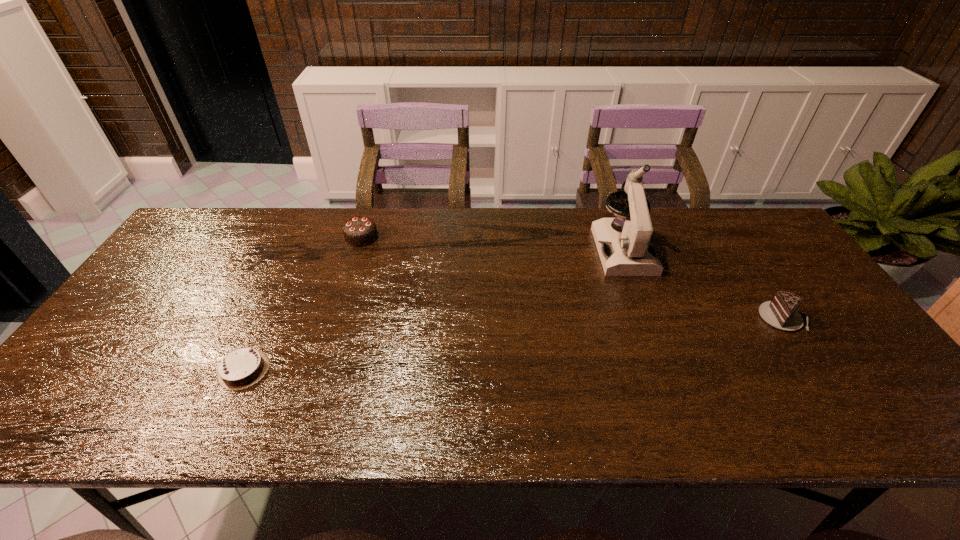
At what (x,y) coordinates should I click in order to perform the action: click on microscope. Please return your answer as a coordinate pair (x, y). Looking at the image, I should click on (630, 252).

You are a GUI agent. You are given a task and a screenshot of the screen. Output one action in this format:
    pyautogui.click(x=<x>, y=<y>)
    Task: Click on the tallest object
    The width and height of the screenshot is (960, 540).
    Given the screenshot: What is the action you would take?
    pyautogui.click(x=630, y=252)

Where is `the farthest chocolate cake`? This screenshot has height=540, width=960. the farthest chocolate cake is located at coordinates (360, 231).

Where is `the tallest chocolate cake`? The height and width of the screenshot is (540, 960). the tallest chocolate cake is located at coordinates (360, 231).

What are the coordinates of `the second nearest chocolate cake` in the screenshot? It's located at (781, 313).

The image size is (960, 540). Find the location of `the rightmost chocolate cake`. the rightmost chocolate cake is located at coordinates (781, 313).

The width and height of the screenshot is (960, 540). I want to click on the shortest object, so click(243, 367).

Image resolution: width=960 pixels, height=540 pixels. Find the location of `the leftmost object`. the leftmost object is located at coordinates (243, 367).

Identify the location of vacant point located at the eyepiece of the second object from right to left. The image size is (960, 540). (658, 342).

Find the location of a particular element. The width and height of the screenshot is (960, 540). blank space located 0.270m on the front of the tallest chocolate cake is located at coordinates (337, 312).